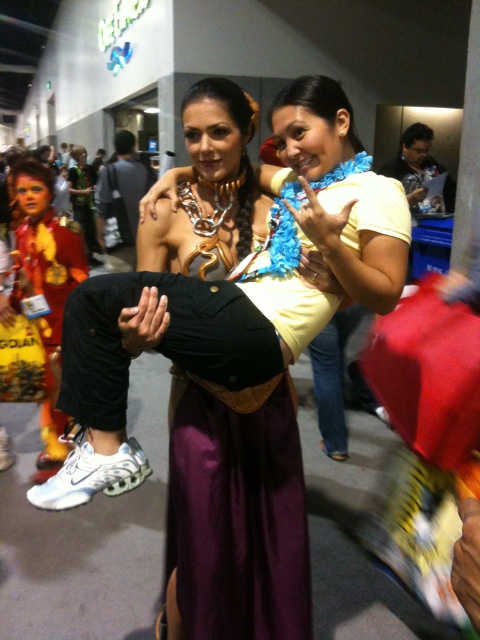
Can you confirm if matte black pants at center is thinner than shiny metallic costume at left?

Incorrect, matte black pants at center's width is not less than shiny metallic costume at left's.

Who is shorter, matte black pants at center or shiny metallic costume at left?

With less height is matte black pants at center.

Find the location of `matte black pants at center`. matte black pants at center is located at coordinates (235, 294).

You are a GUI agent. You are given a task and a screenshot of the screen. Output one action in this format:
    pyautogui.click(x=<x>, y=<y>)
    Task: Click on the matte black pants at center
    The image size is (480, 640).
    Given the screenshot: What is the action you would take?
    pyautogui.click(x=235, y=294)

Does shiny metallic costume at left have a greater width compared to dark gray fabric jacket at center?

Yes, shiny metallic costume at left is wider than dark gray fabric jacket at center.

Can you confirm if shiny metallic costume at left is smaller than dark gray fabric jacket at center?

No.

Who is more forward, [37,288] or [139,172]?

Point [37,288] is in front.

Locate an element on the screen. This screenshot has height=640, width=480. shiny metallic costume at left is located at coordinates (45, 284).

Is dark gray fabric jacket at center shorter than matte black shirt at upper right?

No.

Does point (127, 198) come in front of point (409, 164)?

No, (127, 198) is behind (409, 164).

Measure the distance between dark gray fabric jacket at center and camera.

The distance of dark gray fabric jacket at center from camera is 14.43 feet.

At what (x,y) coordinates should I click in order to perform the action: click on dark gray fabric jacket at center. Please return your answer as a coordinate pair (x, y). Image resolution: width=480 pixels, height=640 pixels. Looking at the image, I should click on (121, 188).